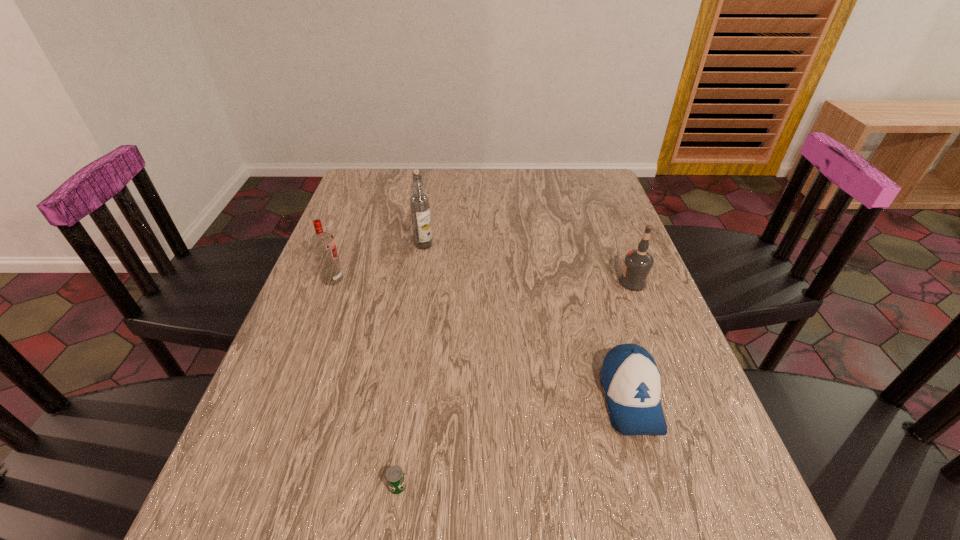
At what (x,y) coordinates should I click in order to perform the action: click on the second vodka from left to right. Please return your answer as a coordinate pair (x, y). This screenshot has height=540, width=960. Looking at the image, I should click on (419, 203).

Find the location of a particular element. Image resolution: width=960 pixels, height=540 pixels. the tallest vodka is located at coordinates [419, 203].

Identify the location of the leftmost object. The height and width of the screenshot is (540, 960). (323, 245).

At what (x,y) coordinates should I click in order to perform the action: click on the rightmost vodka. Please return your answer as a coordinate pair (x, y). This screenshot has width=960, height=540. Looking at the image, I should click on (638, 263).

Image resolution: width=960 pixels, height=540 pixels. In order to click on the fourth tallest object in this screenshot , I will do coord(631,380).

Locate an element on the screen. baseball cap is located at coordinates (631, 380).

Locate an element on the screen. The image size is (960, 540). the nearest object is located at coordinates (395, 478).

Locate an element on the screen. Image resolution: width=960 pixels, height=540 pixels. beer can is located at coordinates 395,478.

Where is `free space located 0.140m on the label of the tallest object`? free space located 0.140m on the label of the tallest object is located at coordinates (418, 285).

Find the location of a particular element. vacant area situated 0.180m on the front label of the leftmost vodka is located at coordinates (415, 279).